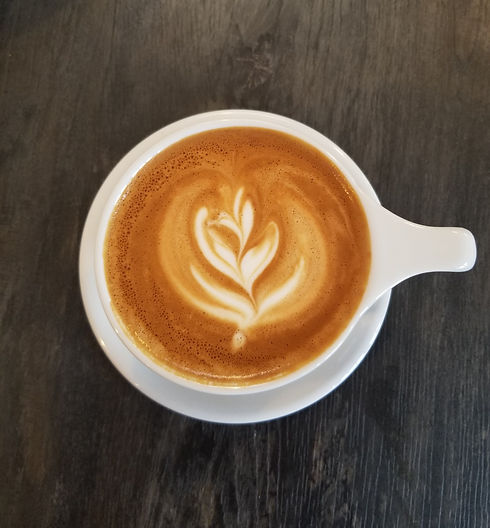
I want to click on woo table, so click(422, 424).